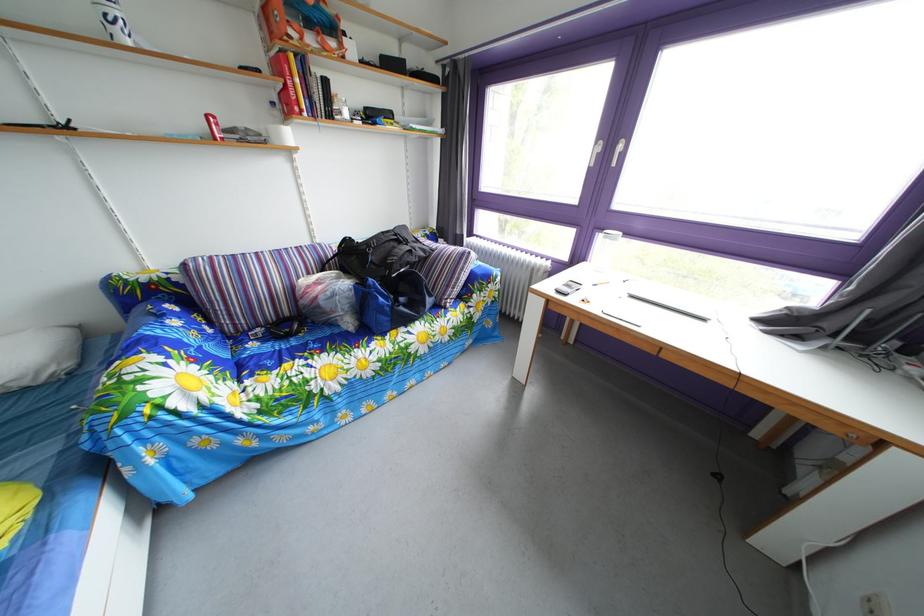
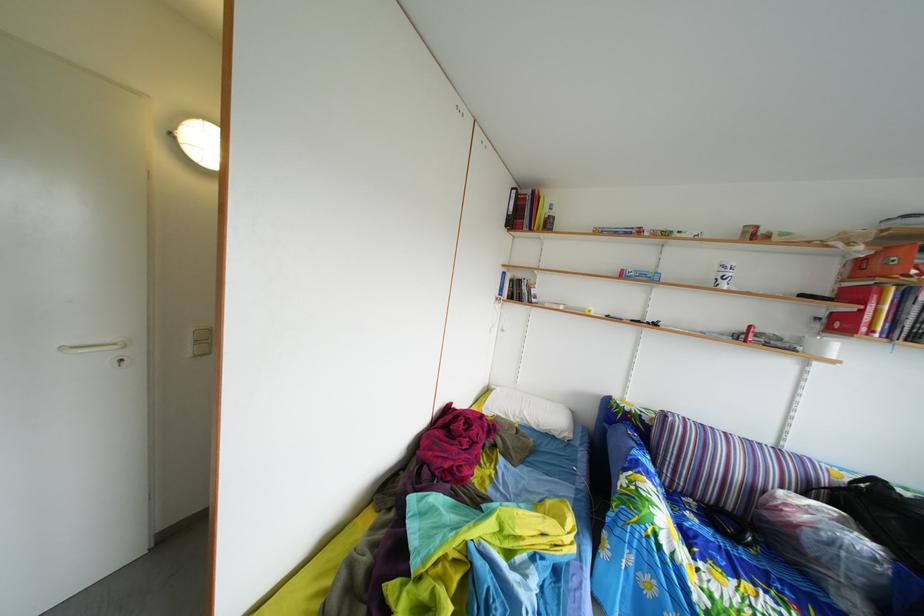
Question: The images are taken continuously from a first-person perspective. In which direction is your viewpoint rotating?

Choices:
 (A) Left
 (B) Right
 (C) Up
 (D) Down

Answer: (A)